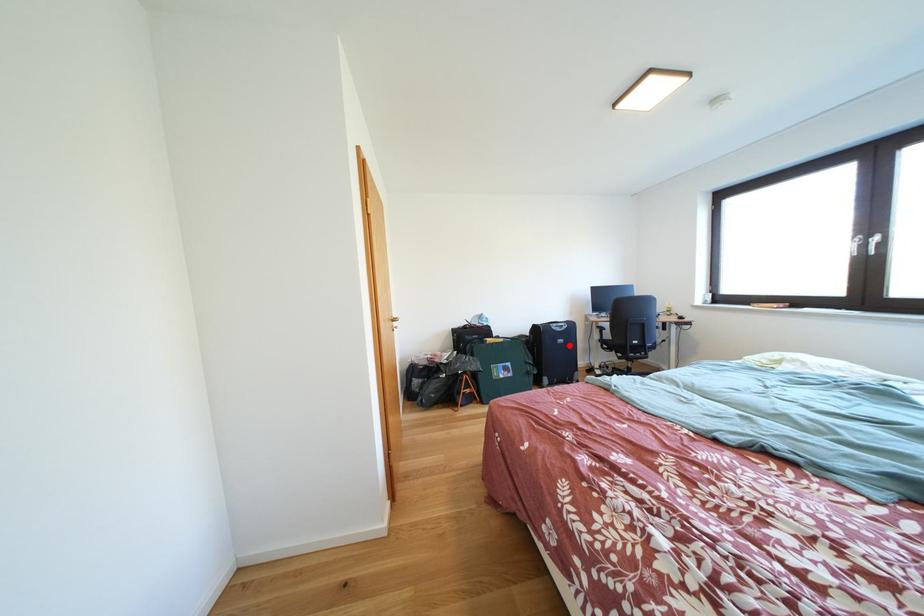
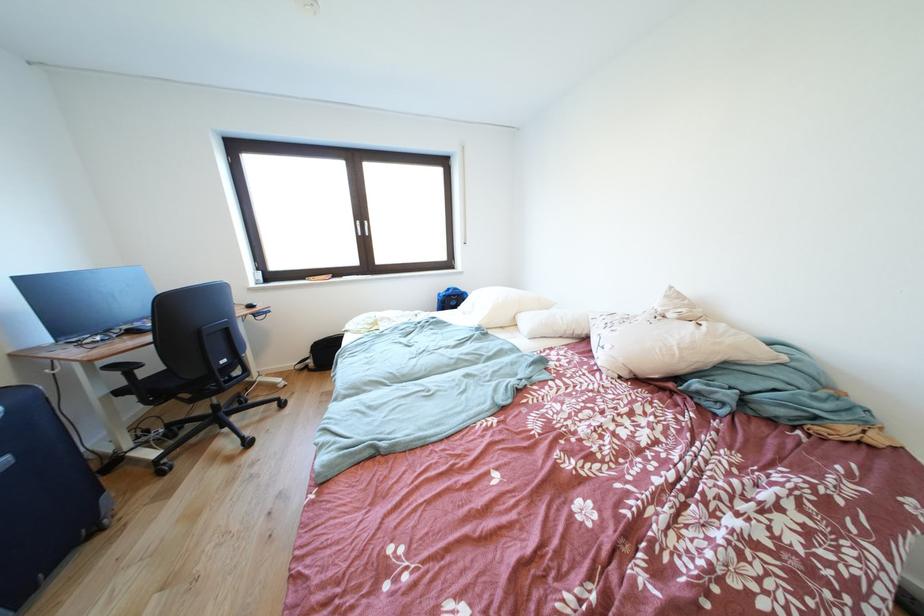
Question: A red point is marked in image1. In image2, is the corresponding 3D point closer to the camera or farther? Reply with the corresponding letter.

Choices:
 (A) The corresponding 3D point is closer.
 (B) The corresponding 3D point is farther.

Answer: (A)